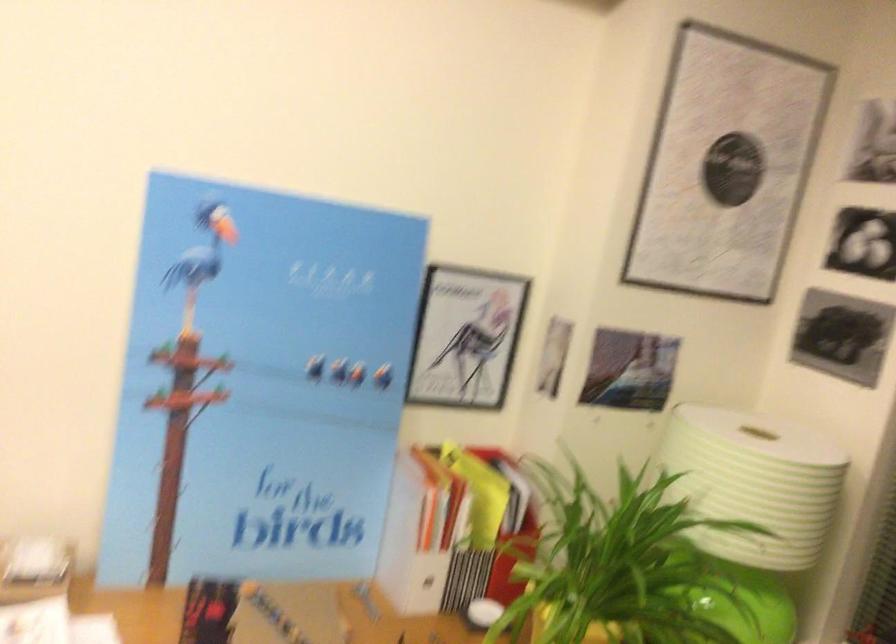
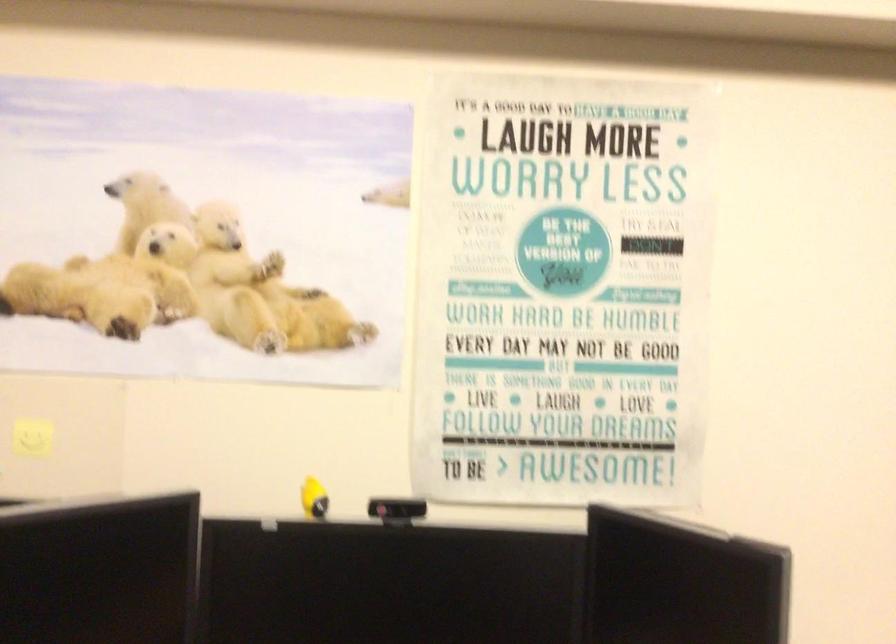
Consider the image. Which direction would the cameraman need to move to produce the second image?

The cameraman walked toward left, backward.